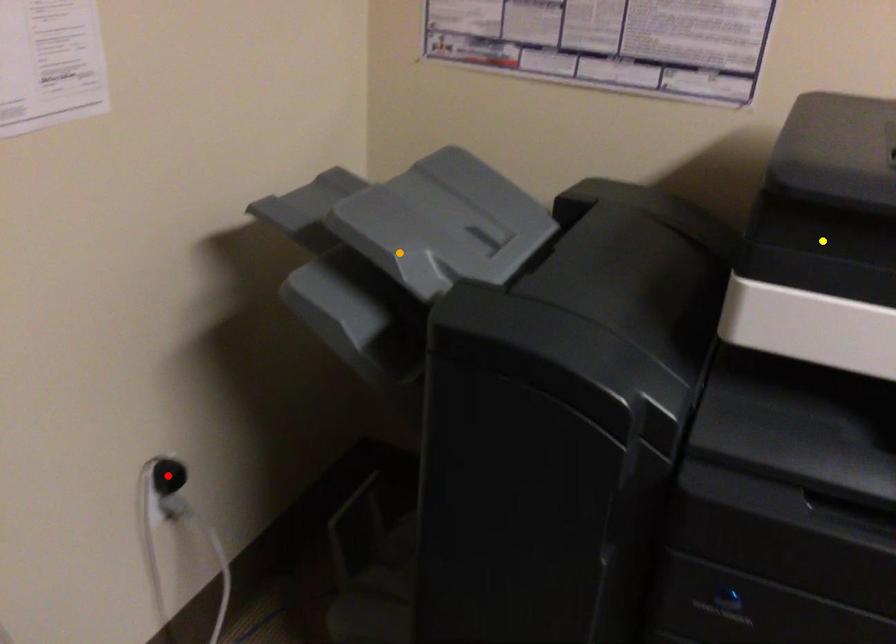
From the picture: Order these from nearest to farthest:
A) red point
B) orange point
C) yellow point

1. red point
2. orange point
3. yellow point